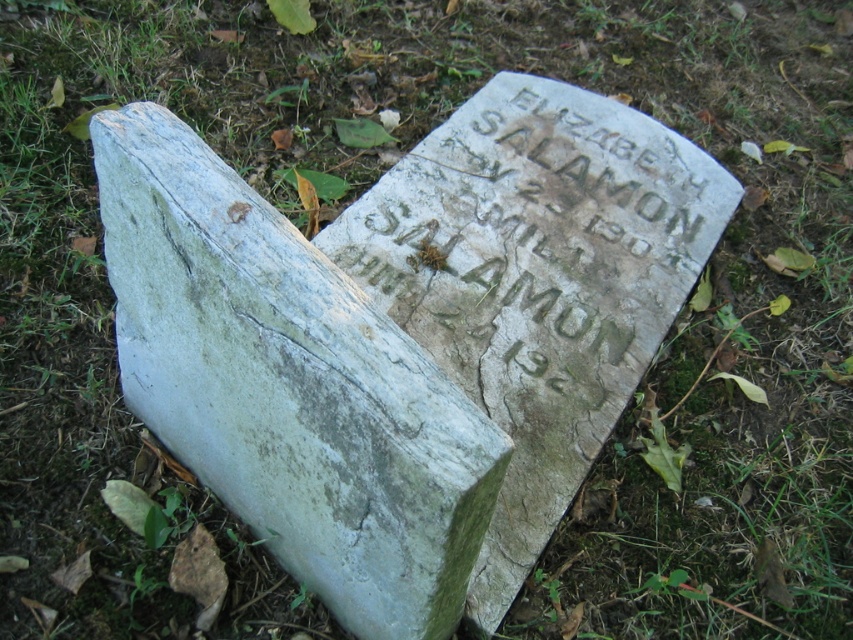
Question: Is white stone gravestone at center positioned before carved stone inscription at center?

Choices:
 (A) no
 (B) yes

Answer: (B)

Question: Is white stone gravestone at center above carved stone inscription at center?

Choices:
 (A) yes
 (B) no

Answer: (B)

Question: Which of the following is the farthest from the observer?

Choices:
 (A) (631, 234)
 (B) (345, 342)

Answer: (A)

Question: Does white stone gravestone at center appear under carved stone inscription at center?

Choices:
 (A) no
 (B) yes

Answer: (B)

Question: Which point is closer to the camera taking this photo?

Choices:
 (A) (567, 182)
 (B) (296, 573)

Answer: (B)